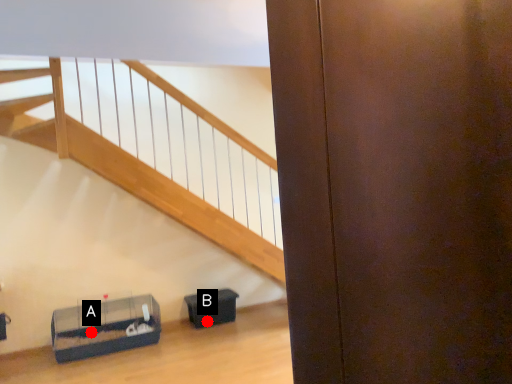
Question: Two points are circled on the image, labeled by A and B beside each circle. Among these points, which one is farthest from the camera?

Choices:
 (A) A is further
 (B) B is further

Answer: (B)